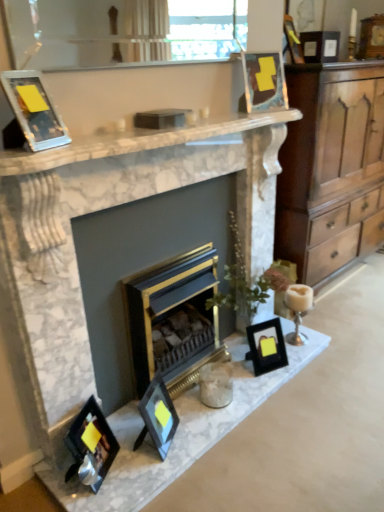
The width and height of the screenshot is (384, 512). Identify the location of matte black picture frame at upper right, the 6th picture frame ordered from the bottom. (292, 40).

Find the location of a particular element. black glass frames at lower left is located at coordinates (176, 435).

Where is `matte glass picture frame at upper left, arranged as the 7th picture frame when viewed from the right`? This screenshot has height=512, width=384. matte glass picture frame at upper left, arranged as the 7th picture frame when viewed from the right is located at coordinates (34, 110).

What do you see at coordinates (138, 141) in the screenshot? This screenshot has height=512, width=384. I see `marble fireplace mantel at upper center` at bounding box center [138, 141].

Locate an element on the screen. wooden cabinet at right is located at coordinates pyautogui.click(x=331, y=167).

Looking at this image, considering the sizes of objects white ceramic candle holder at right and marble fireplace at center, marked as the first fireplace in a left-to-right arrangement, in the image provided, who is thinner, white ceramic candle holder at right or marble fireplace at center, marked as the first fireplace in a left-to-right arrangement,?

white ceramic candle holder at right.

Consider the image. Would you say marble fireplace at center, marked as the first fireplace in a left-to-right arrangement, is part of white ceramic candle holder at right's contents?

No, marble fireplace at center, marked as the first fireplace in a left-to-right arrangement, is not surrounded by white ceramic candle holder at right.

The height and width of the screenshot is (512, 384). In order to click on candle holder located on the right of marble fireplace at center, marked as the first fireplace in a left-to-right arrangement in this screenshot , I will do `click(298, 310)`.

How distant is white ceramic candle holder at right from marble fireplace at center, marked as the first fireplace in a left-to-right arrangement?

They are 35.03 inches apart.

Locate an element on the screen. The height and width of the screenshot is (512, 384). the 4th picture frame directly above the matte black picture frame at lower left, which is the 2th picture frame in left-to-right order (from a real-world perspective) is located at coordinates (292, 40).

Is matte black picture frame at lower left, which is counted as the sixth picture frame, starting from the back, at the left side of matte black picture frame at upper right, which appears as the 2th picture frame when viewed from the right?

Yes, matte black picture frame at lower left, which is counted as the sixth picture frame, starting from the back, is to the left of matte black picture frame at upper right, which appears as the 2th picture frame when viewed from the right.

Based on the photo, who is shorter, matte black picture frame at lower left, placed as the sixth picture frame when sorted from right to left, or matte black picture frame at upper right, which is the sixth picture frame in left-to-right order?

With less height is matte black picture frame at upper right, which is the sixth picture frame in left-to-right order.

Is point (105, 452) positioned before point (300, 62)?

Yes, point (105, 452) is closer to viewer.

Can we say black matte picture frame at lower right, which is the third picture frame in bottom-to-top order, lies outside matte black picture frame at upper right, which appears as the second picture frame when viewed from the back?

Yes, black matte picture frame at lower right, which is the third picture frame in bottom-to-top order, is located beyond the bounds of matte black picture frame at upper right, which appears as the second picture frame when viewed from the back.

Which object is positioned more to the right, black matte picture frame at lower right, which is the 3th picture frame in back-to-front order, or matte black picture frame at upper right, the 6th picture frame from the front?

Positioned to the right is matte black picture frame at upper right, the 6th picture frame from the front.

Can you confirm if black matte picture frame at lower right, arranged as the fifth picture frame when viewed from the left, is thinner than matte black picture frame at upper right, the second picture frame in the top-to-bottom sequence?

In fact, black matte picture frame at lower right, arranged as the fifth picture frame when viewed from the left, might be wider than matte black picture frame at upper right, the second picture frame in the top-to-bottom sequence.

From the picture: Which is closer to the camera, [260,336] or [292,30]?

Point [260,336].

From a real-world perspective, is gold/black fireplace at center, which appears as the 2th fireplace when viewed from the left, on top of matte glass picture frame at upper left, which is counted as the seventh picture frame, starting from the back?

Actually, gold/black fireplace at center, which appears as the 2th fireplace when viewed from the left, is physically below matte glass picture frame at upper left, which is counted as the seventh picture frame, starting from the back, in the real world.

Which is less distant, [191,303] or [30,81]?

The point [30,81] is in front.

Which of these two, gold/black fireplace at center, the 1th fireplace from the right, or matte glass picture frame at upper left, the 4th picture frame when ordered from top to bottom, stands taller?

With more height is gold/black fireplace at center, the 1th fireplace from the right.

Is gold/black fireplace at center, the 1th fireplace from the right, wider than matte glass picture frame at upper left, which is counted as the seventh picture frame, starting from the back?

Indeed, gold/black fireplace at center, the 1th fireplace from the right, has a greater width compared to matte glass picture frame at upper left, which is counted as the seventh picture frame, starting from the back.

Who is shorter, marble fireplace mantel at upper center or marble fireplace at center, marked as the 2th fireplace in a right-to-left arrangement?

marble fireplace mantel at upper center is shorter.

From the picture: Could you tell me if marble fireplace mantel at upper center is facing marble fireplace at center, marked as the 2th fireplace in a right-to-left arrangement?

No, marble fireplace mantel at upper center is not oriented towards marble fireplace at center, marked as the 2th fireplace in a right-to-left arrangement.

At what (x,y) coordinates should I click in order to perform the action: click on counter top located above the marble fireplace at center, marked as the 2th fireplace in a right-to-left arrangement (from the image's perspective). Please return your answer as a coordinate pair (x, y). Looking at the image, I should click on (138, 141).

From a real-world perspective, which object stands above the other?

In real-world perspective, marble fireplace mantel at upper center is above.

Between black matte picture frame at lower right, the fifth picture frame from the top, and marble fireplace mantel at upper center, which one appears on the left side from the viewer's perspective?

marble fireplace mantel at upper center.

Which picture frame is the 2nd one when counting from the right side of the marble fireplace mantel at upper center? Please provide its 2D coordinates.

[(267, 346)]

Is clear glass window screen at upper center taller than white ceramic candle holder at right?

No, clear glass window screen at upper center is not taller than white ceramic candle holder at right.

Is clear glass window screen at upper center oriented away from white ceramic candle holder at right?

No, clear glass window screen at upper center's orientation is not away from white ceramic candle holder at right.

How many degrees apart are the facing directions of clear glass window screen at upper center and white ceramic candle holder at right?

They differ by 0.187 degrees in their facing directions.

From a real-world perspective, starting from the white ceramic candle holder at right, which fireplace is the 2nd one vertically above it? Please provide its 2D coordinates.

[(99, 210)]

Identify the location of picture frame that is the 4th one when counting forward from the matte black picture frame at upper right, the 6th picture frame ordered from the bottom. (91, 446).

Looking at the image, which one is located further to white ceramic candle holder at right, matte black picture frame at lower left, which is the 7th picture frame in top-to-bottom order, or wooden cabinet at right?

The object further to white ceramic candle holder at right is matte black picture frame at lower left, which is the 7th picture frame in top-to-bottom order.

Considering their positions, is marble fireplace mantel at upper center positioned further to metallic gold picture frame at upper center, marked as the 4th picture frame in a right-to-left arrangement, than clear glass window screen at upper center?

clear glass window screen at upper center is further to metallic gold picture frame at upper center, marked as the 4th picture frame in a right-to-left arrangement.

Considering their positions, is clear glass window screen at upper center positioned closer to metallic gold picture frame at upper center, which is counted as the fifth picture frame, starting from the bottom, than wooden cabinet at right?

The object closer to metallic gold picture frame at upper center, which is counted as the fifth picture frame, starting from the bottom, is clear glass window screen at upper center.

Looking at the image, which one is located closer to metallic gold picture frame at upper center, arranged as the fourth picture frame when viewed from the back, matte black picture frame at lower left, marked as the 1th picture frame in a bottom-to-top arrangement, or matte black picture frame at upper right, the 6th picture frame ordered from the bottom?

matte black picture frame at upper right, the 6th picture frame ordered from the bottom, is closer to metallic gold picture frame at upper center, arranged as the fourth picture frame when viewed from the back.

Considering their positions, is white ceramic candle holder at right positioned further to metallic gold picture frame at upper center, the 3th picture frame viewed from the top, than marble fireplace at center, marked as the 2th fireplace in a right-to-left arrangement?

white ceramic candle holder at right is further to metallic gold picture frame at upper center, the 3th picture frame viewed from the top.

Considering their positions, is gold/black fireplace at center, the 1th fireplace from the right, positioned further to matte black picture frame at upper right, which is the sixth picture frame in left-to-right order, than wooden cabinet at right?

gold/black fireplace at center, the 1th fireplace from the right, is further to matte black picture frame at upper right, which is the sixth picture frame in left-to-right order.

Based on their spatial positions, is marble fireplace at center, marked as the first fireplace in a left-to-right arrangement, or white ceramic candle holder at right further from metallic gold picture frame at upper center, placed as the fourth picture frame when sorted from front to back?

white ceramic candle holder at right lies further to metallic gold picture frame at upper center, placed as the fourth picture frame when sorted from front to back, than the other object.

When comparing their distances from matte black picture frame at upper right, the 6th picture frame ordered from the bottom, does wooden cabinet at right or gold/black fireplace at center, the 1th fireplace from the right, seem closer?

wooden cabinet at right.

Identify the location of candle holder between matte glass picture frame at upper left, the 4th picture frame when ordered from top to bottom, and wooden cabinet at right. (298, 310).

This screenshot has height=512, width=384. I want to click on table between marble fireplace at center, marked as the first fireplace in a left-to-right arrangement, and matte black picture frame at lower left, which is the 7th picture frame in top-to-bottom order, in the up-down direction, so point(176,435).

Find the location of a particular element. The width and height of the screenshot is (384, 512). counter top between matte glass picture frame at upper left, the 1th picture frame viewed from the front, and wooden cabinet at right from left to right is located at coordinates (138, 141).

The image size is (384, 512). I want to click on cabinetry that lies between matte black picture frame at upper right, which appears as the 2th picture frame when viewed from the right, and black glass frames at lower left from top to bottom, so click(x=331, y=167).